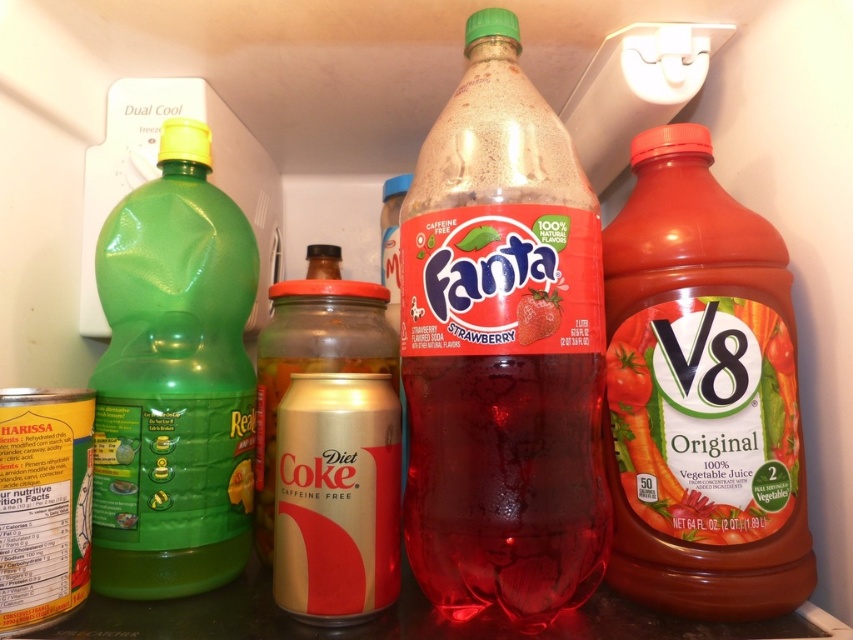
You are organizing the fridge and need to place a new item between the translucent plastic bottle at center and the green plastic bottle at left. The item is 4 inches wide. Is there enough space between them?

The translucent plastic bottle at center and green plastic bottle at left are 8.83 inches apart, so yes, there is enough space to place a 4 inch wide item between them.

From the picture: You are organizing the refrigerator shelves and need to move the translucent plastic bottle at center and the green plastic bottle at left. Which bottle should you move first to access the other?

You should move the translucent plastic bottle at center first because it is positioned over the green plastic bottle at left, so removing it first will allow access to the green plastic bottle at left.